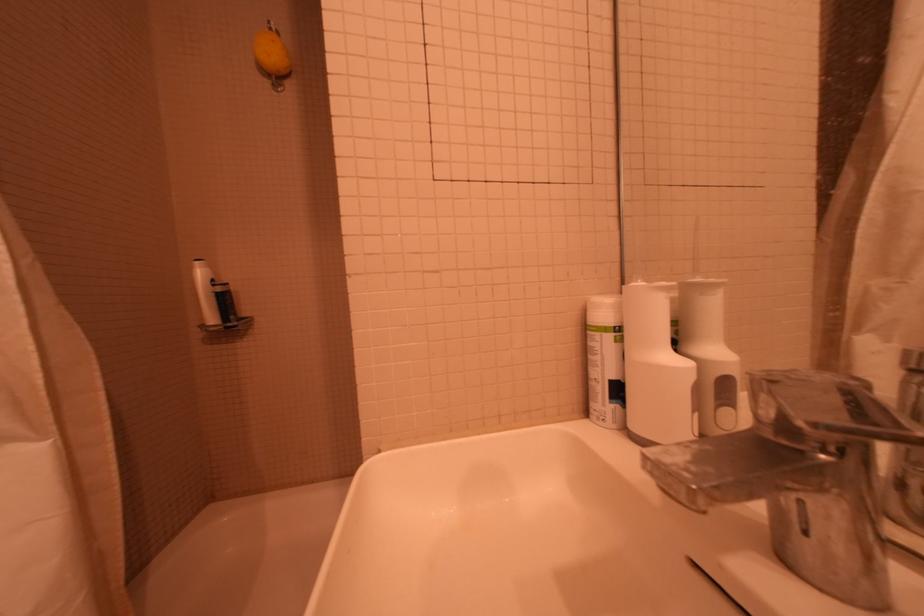
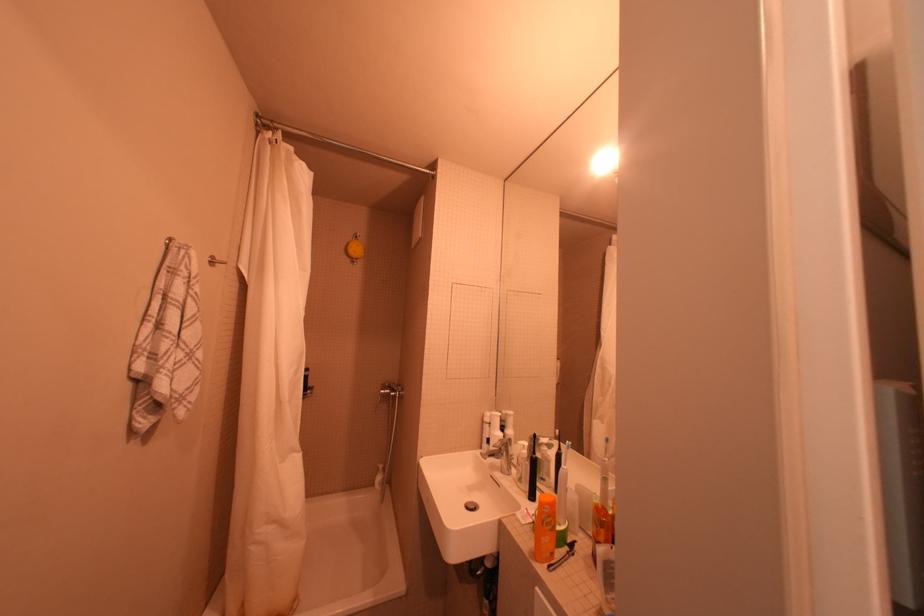
Find the pixel in the second image that matches point 274,83 in the first image.

(358, 261)